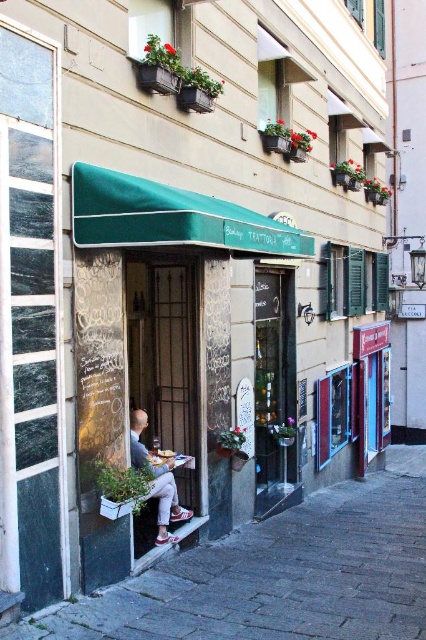
Looking at this image, you are a delivery person standing on the paved stone pavement at lower center and need to hand a package to the man wearing the light gray fabric pants at lower center. Can you directly reach him without moving from your current position?

The paved stone pavement at lower center is in front of the light gray fabric pants at lower center, meaning the pavement is between you and the man. To reach him, you would need to step off the pavement towards him.

You are a delivery person standing on the paved stone pavement at lower center and need to place a package next to the light gray fabric pants at lower center. Can you fit the package between them without moving the pants?

The paved stone pavement at lower center is wider than the light gray fabric pants at lower center, so there is enough space to place the package between them without moving the pants.

You are standing at the point marked as point (354, 531) in the image, which is 8.28 meters away from you. If you want to walk towards the restaurant entrance, which direction should you go?

The point (354, 531) is 8.28 meters away from the viewer. Since the restaurant entrance is under the green awning with the decorative patterned glass door, you should walk towards the entrance located under the green awning to reach it from your current position.